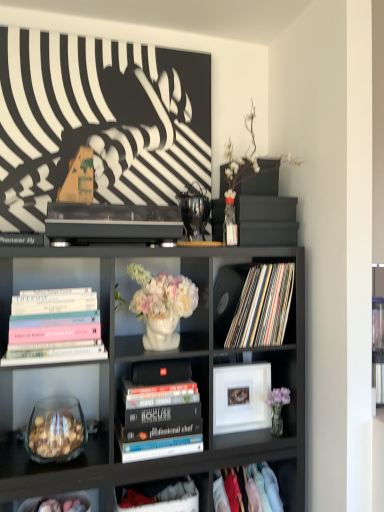
What are the coordinates of `empty space that is ontop of hardcover books at center, which ranks as the third book in top-to-bottom order` in the screenshot? It's located at (153, 379).